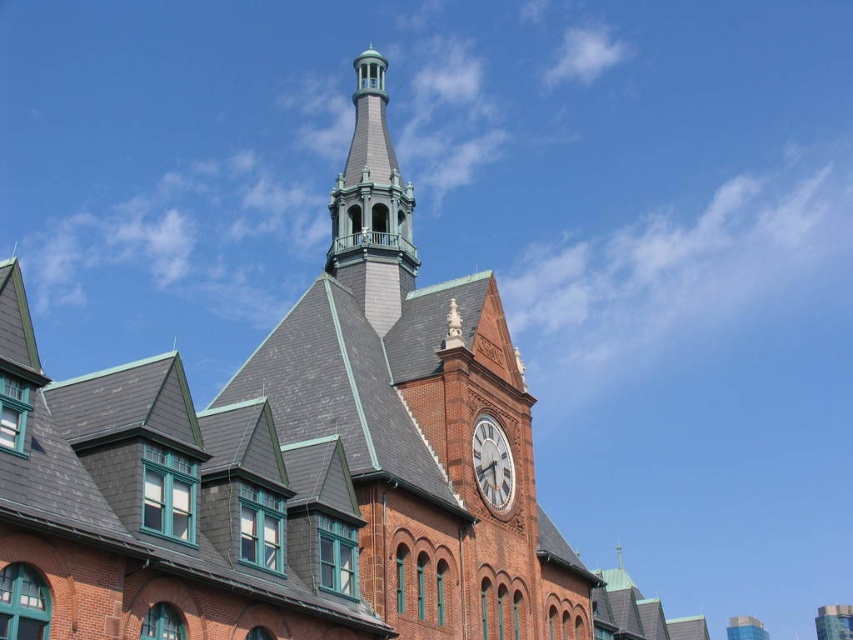
Is red brick church at center to the right of white metallic clock at upper center from the viewer's perspective?

In fact, red brick church at center is to the left of white metallic clock at upper center.

Does point (196, 529) come in front of point (492, 432)?

Yes, it is.

Find the location of a particular element. The height and width of the screenshot is (640, 853). red brick church at center is located at coordinates (289, 461).

This screenshot has width=853, height=640. Describe the element at coordinates (372, 205) in the screenshot. I see `green copper bell tower at upper center` at that location.

Where is `green copper bell tower at upper center`? Image resolution: width=853 pixels, height=640 pixels. green copper bell tower at upper center is located at coordinates (372, 205).

Is red brick church at center to the left of green copper bell tower at upper center from the viewer's perspective?

Incorrect, red brick church at center is not on the left side of green copper bell tower at upper center.

Can you confirm if red brick church at center is positioned below green copper bell tower at upper center?

Indeed, red brick church at center is positioned under green copper bell tower at upper center.

The width and height of the screenshot is (853, 640). What do you see at coordinates (289, 461) in the screenshot? I see `red brick church at center` at bounding box center [289, 461].

This screenshot has height=640, width=853. What are the coordinates of `red brick church at center` in the screenshot? It's located at (289, 461).